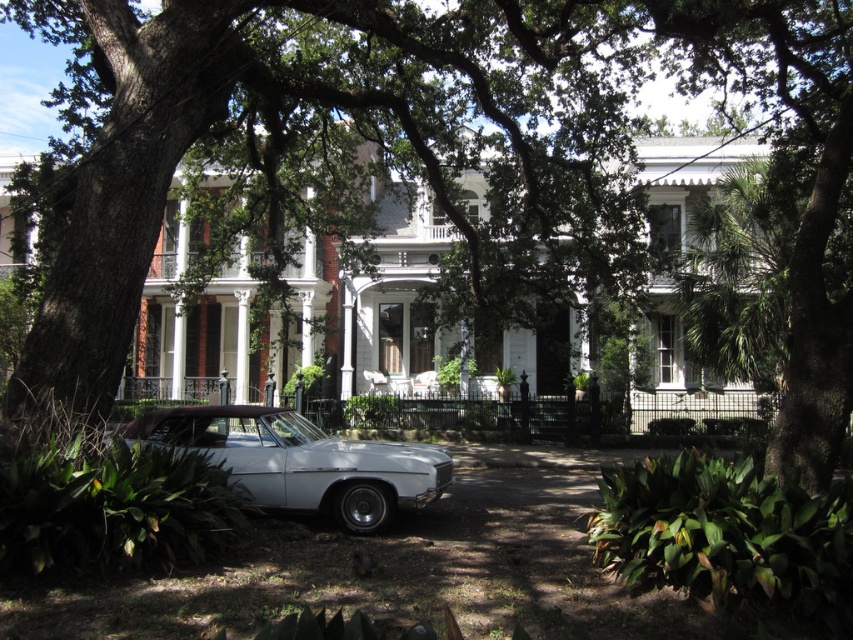
Who is positioned more to the left, green leafy tree at center or white glossy car at lower center?

white glossy car at lower center

Is point (73, 122) closer to camera compared to point (297, 420)?

No, it is behind (297, 420).

Locate an element on the screen. green leafy tree at center is located at coordinates (339, 150).

At what (x,y) coordinates should I click in order to perform the action: click on green leafy tree at center. Please return your answer as a coordinate pair (x, y). This screenshot has width=853, height=640. Looking at the image, I should click on (339, 150).

Can you confirm if white glossy car at lower center is positioned above white painted wood porch at center?

Yes.

Does white glossy car at lower center appear under white painted wood porch at center?

Actually, white glossy car at lower center is above white painted wood porch at center.

Between point (316, 477) and point (148, 387), which one is positioned in front?

Point (316, 477)

You are a GUI agent. You are given a task and a screenshot of the screen. Output one action in this format:
    pyautogui.click(x=<x>, y=<y>)
    Task: Click on the white glossy car at lower center
    Image resolution: width=853 pixels, height=640 pixels.
    Given the screenshot: What is the action you would take?
    pyautogui.click(x=302, y=461)

Does green leafy tree at center have a greater height compared to white painted wood porch at center?

Yes, green leafy tree at center is taller than white painted wood porch at center.

Is green leafy tree at center thinner than white painted wood porch at center?

Yes.

Between point (466, 49) and point (132, 403), which one is positioned in front?

Point (466, 49) is more forward.

Where is `green leafy tree at center`? green leafy tree at center is located at coordinates (339, 150).